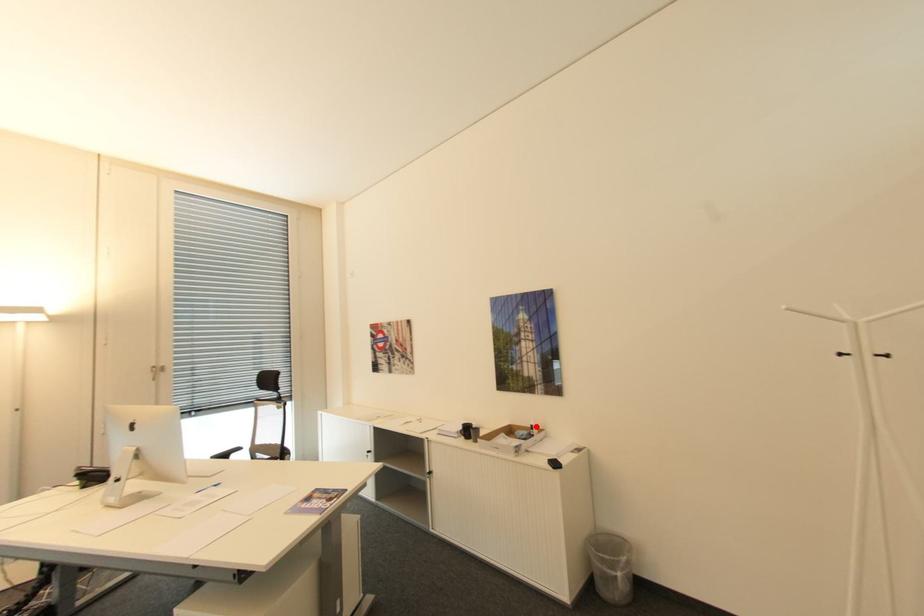
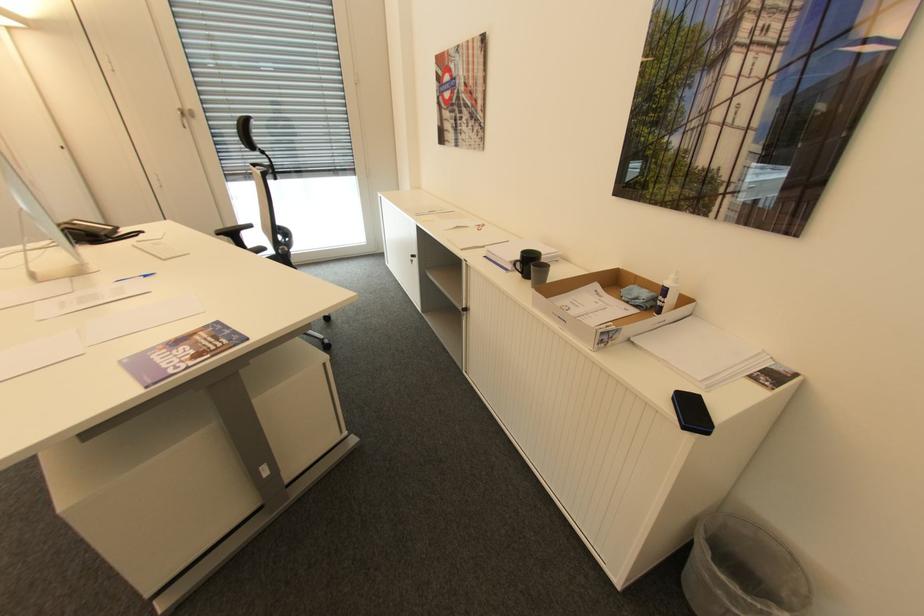
Question: I am providing you with two images of the same scene from different viewpoints. In image1, a red point is highlighted. Considering the same 3D point in image2, which of the following is correct?

Choices:
 (A) It is closer
 (B) It is farther

Answer: (A)